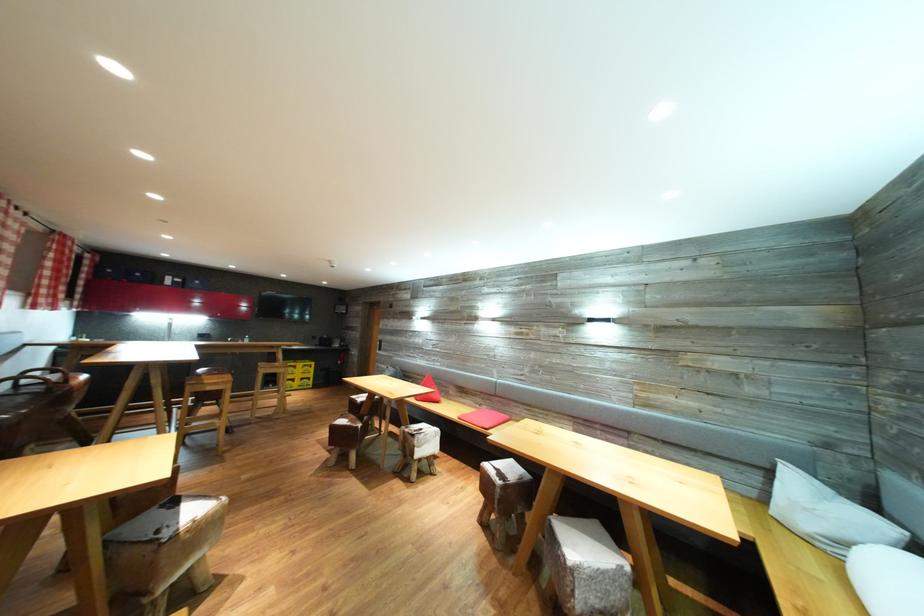
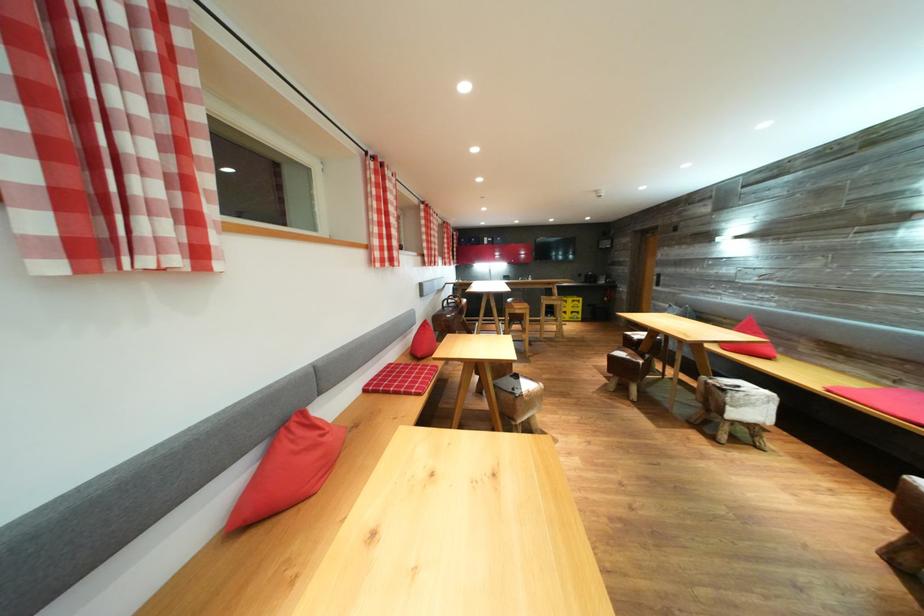
In the second image, find the point that corresponds to point 307,370 in the first image.

(577, 305)